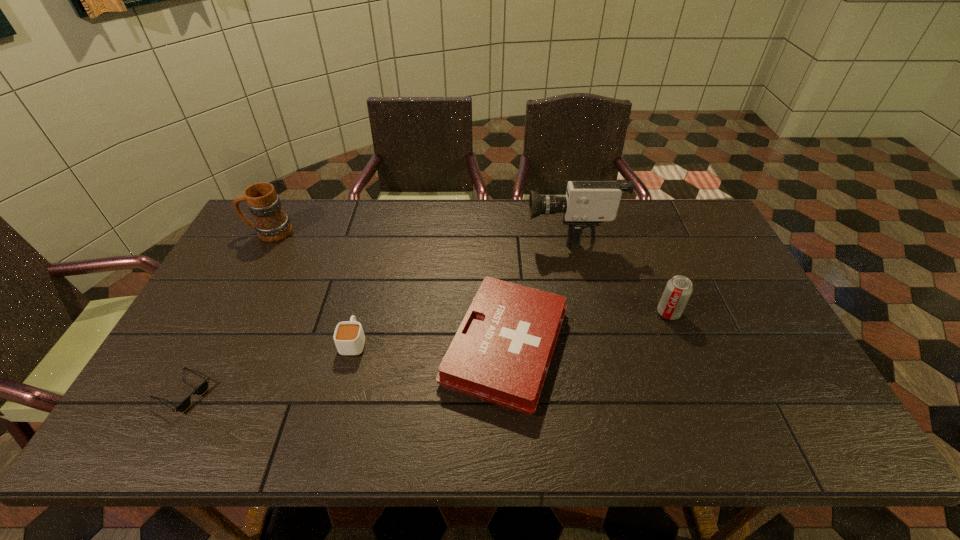
The width and height of the screenshot is (960, 540). What are the coordinates of `free space located on the left of the rightmost object` in the screenshot? It's located at (571, 313).

Image resolution: width=960 pixels, height=540 pixels. Identify the location of free region located on the side with the handle of the fourth object from right to left. (371, 273).

Where is `free space located on the side with the handle of the fourth object from right to left`? free space located on the side with the handle of the fourth object from right to left is located at coordinates (362, 310).

The width and height of the screenshot is (960, 540). Identify the location of vacant region located on the side with the handle of the fourth object from right to left. (377, 249).

Where is `vacant space located 0.260m on the right of the first-aid kit`? vacant space located 0.260m on the right of the first-aid kit is located at coordinates (671, 347).

In order to click on vacant space located 0.200m on the lenses of the shortest object in this screenshot , I will do point(294,393).

Identify the location of camcorder that is positioned at the far edge. The image size is (960, 540). (587, 203).

Image resolution: width=960 pixels, height=540 pixels. Identify the location of mug that is at the far edge. (271, 223).

Identify the location of the first-aid kit that is at the near edge. (501, 353).

The height and width of the screenshot is (540, 960). I want to click on sunglasses that is at the near edge, so click(x=200, y=390).